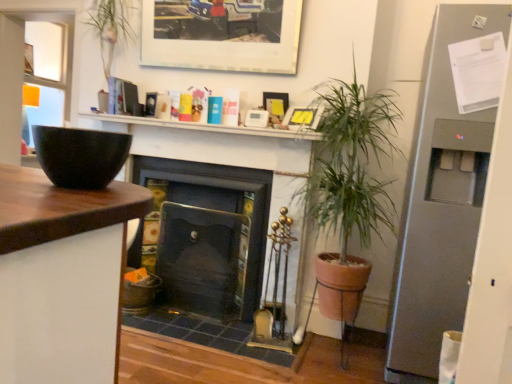
Question: Is matte black fireplace at center, the 2th fireplace viewed from the right, positioned with its back to matte yellow picture frame at upper center, which is counted as the 2th picture frame, starting from the bottom?

Choices:
 (A) yes
 (B) no

Answer: (B)

Question: From the image's perspective, is matte black fireplace at center, the 2th fireplace viewed from the right, over matte yellow picture frame at upper center, which is counted as the second picture frame, starting from the top?

Choices:
 (A) no
 (B) yes

Answer: (A)

Question: Considering the relative positions of matte black fireplace at center, positioned as the first fireplace in left-to-right order, and matte yellow picture frame at upper center, which is counted as the second picture frame, starting from the top, in the image provided, is matte black fireplace at center, positioned as the first fireplace in left-to-right order, to the right of matte yellow picture frame at upper center, which is counted as the second picture frame, starting from the top, from the viewer's perspective?

Choices:
 (A) yes
 (B) no

Answer: (B)

Question: Would you say matte black fireplace at center, positioned as the first fireplace in left-to-right order, is a long distance from matte yellow picture frame at upper center, which is counted as the 2th picture frame, starting from the bottom?

Choices:
 (A) yes
 (B) no

Answer: (B)

Question: Is matte yellow picture frame at upper center, which is counted as the second picture frame, starting from the top, surrounded by matte black fireplace at center, the 2th fireplace viewed from the right?

Choices:
 (A) yes
 (B) no

Answer: (B)

Question: Would you say yellow paper picture frame at upper center, arranged as the 3th picture frame when viewed from the top, is to the left or to the right of matte white picture frame at upper center, placed as the third picture frame when sorted from bottom to top, in the picture?

Choices:
 (A) left
 (B) right

Answer: (B)

Question: In terms of size, does yellow paper picture frame at upper center, arranged as the 3th picture frame when viewed from the top, appear bigger or smaller than matte white picture frame at upper center, which is counted as the 1th picture frame, starting from the top?

Choices:
 (A) big
 (B) small

Answer: (B)

Question: Is yellow paper picture frame at upper center, positioned as the 1th picture frame in bottom-to-top order, in front of or behind matte white picture frame at upper center, which is counted as the 1th picture frame, starting from the top, in the image?

Choices:
 (A) front
 (B) behind

Answer: (A)

Question: Is yellow paper picture frame at upper center, arranged as the 3th picture frame when viewed from the top, taller or shorter than matte white picture frame at upper center, placed as the third picture frame when sorted from bottom to top?

Choices:
 (A) short
 (B) tall

Answer: (A)

Question: Looking at their shapes, would you say white matte shelf at upper center is wider or thinner than matte yellow picture frame at upper center, which is counted as the 2th picture frame, starting from the bottom?

Choices:
 (A) thin
 (B) wide

Answer: (B)

Question: Is white matte shelf at upper center inside the boundaries of matte yellow picture frame at upper center, which is counted as the 2th picture frame, starting from the bottom, or outside?

Choices:
 (A) outside
 (B) inside

Answer: (A)

Question: Considering the positions of white matte shelf at upper center and matte yellow picture frame at upper center, which is counted as the second picture frame, starting from the top, in the image, is white matte shelf at upper center bigger or smaller than matte yellow picture frame at upper center, which is counted as the second picture frame, starting from the top,?

Choices:
 (A) small
 (B) big

Answer: (B)

Question: Is point (116, 120) positioned closer to the camera than point (278, 114)?

Choices:
 (A) farther
 (B) closer

Answer: (A)

Question: Is green leafy plant at center wider or thinner than yellow paper picture frame at upper center, arranged as the 3th picture frame when viewed from the top?

Choices:
 (A) thin
 (B) wide

Answer: (B)

Question: From the image's perspective, is green leafy plant at center positioned above or below yellow paper picture frame at upper center, arranged as the 3th picture frame when viewed from the top?

Choices:
 (A) above
 (B) below

Answer: (B)